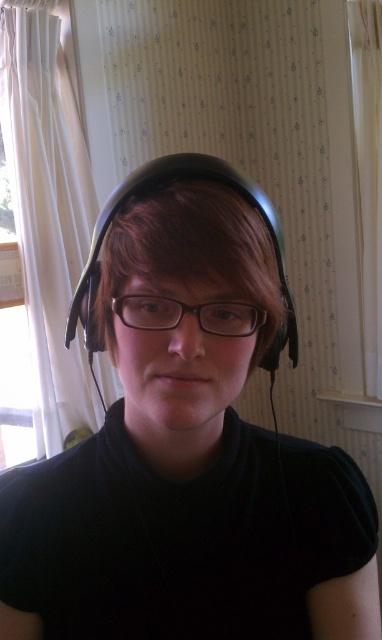
You are trying to decide whether to hang a small picture frame between the white sheer curtain at right and the transparent plastic glasses at center. Based on their sizes, which object would require more space?

The white sheer curtain at right is larger in size than the transparent plastic glasses at center, so it would require more space.

You are standing in the room and see the point at coordinates (x=369, y=172). Based on the scene description, can you determine which object this point is located on?

The point at coordinates (x=369, y=172) is located on the white sheer curtain at right.